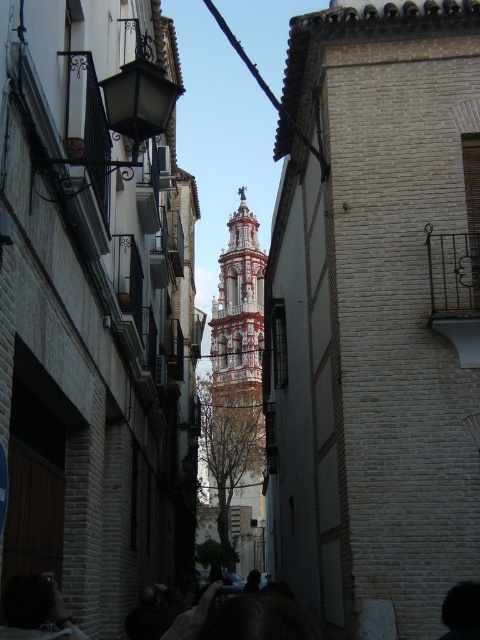
You are a tourist standing in the middle of the narrow street between the two buildings. You see two people with dark brown hair at lower left and dark hair at lower right. Which person is closer to the red and white tower in the background?

The dark hair at lower right is closer to the red and white tower in the background because it is positioned to the right side of the street, and the tower is in the background behind the buildings.

You are a tourist standing on the narrow street between the two buildings. You notice the white painted brick bell tower at center and the dark hair at lower right. Which object is wider from your perspective?

The white painted brick bell tower at center might be wider than dark hair at lower right according to the description.

What is the exact coordinate of the dark brown hair at lower left?

The dark brown hair at lower left is located at coordinate point (36, 611).